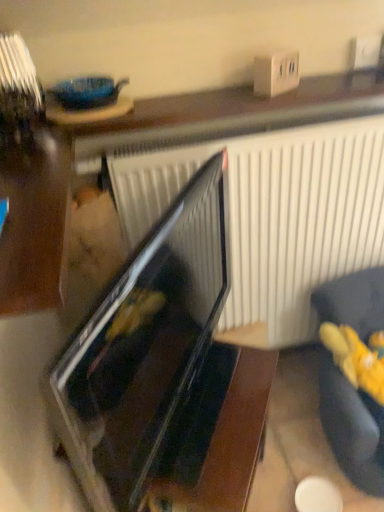
Question: From a real-world perspective, is dark fabric couch at lower right positioned under black glossy oven at center based on gravity?

Choices:
 (A) no
 (B) yes

Answer: (B)

Question: Considering the relative positions of dark fabric couch at lower right and black glossy oven at center in the image provided, is dark fabric couch at lower right in front of black glossy oven at center?

Choices:
 (A) no
 (B) yes

Answer: (A)

Question: Is dark fabric couch at lower right bigger than black glossy oven at center?

Choices:
 (A) no
 (B) yes

Answer: (B)

Question: Is dark fabric couch at lower right not inside black glossy oven at center?

Choices:
 (A) yes
 (B) no

Answer: (A)

Question: Would you consider dark fabric couch at lower right to be distant from black glossy oven at center?

Choices:
 (A) yes
 (B) no

Answer: (B)

Question: From their relative heights in the image, would you say dark fabric couch at lower right is taller or shorter than yellow plush toy at lower right?

Choices:
 (A) tall
 (B) short

Answer: (A)

Question: From a real-world perspective, relative to yellow plush toy at lower right, is dark fabric couch at lower right vertically above or below?

Choices:
 (A) above
 (B) below

Answer: (B)

Question: Considering the positions of dark fabric couch at lower right and yellow plush toy at lower right in the image, is dark fabric couch at lower right bigger or smaller than yellow plush toy at lower right?

Choices:
 (A) big
 (B) small

Answer: (A)

Question: Is dark fabric couch at lower right in front of or behind yellow plush toy at lower right in the image?

Choices:
 (A) behind
 (B) front

Answer: (B)

Question: Considering the positions of dark fabric couch at lower right and black glossy oven at center in the image, is dark fabric couch at lower right wider or thinner than black glossy oven at center?

Choices:
 (A) thin
 (B) wide

Answer: (B)

Question: Is dark fabric couch at lower right bigger or smaller than black glossy oven at center?

Choices:
 (A) small
 (B) big

Answer: (B)

Question: Is dark fabric couch at lower right inside or outside of black glossy oven at center?

Choices:
 (A) inside
 (B) outside

Answer: (B)

Question: From the image's perspective, relative to black glossy oven at center, is dark fabric couch at lower right above or below?

Choices:
 (A) above
 (B) below

Answer: (B)

Question: From the image's perspective, is yellow plush toy at lower right above or below dark fabric couch at lower right?

Choices:
 (A) below
 (B) above

Answer: (B)

Question: Is yellow plush toy at lower right taller or shorter than dark fabric couch at lower right?

Choices:
 (A) tall
 (B) short

Answer: (B)